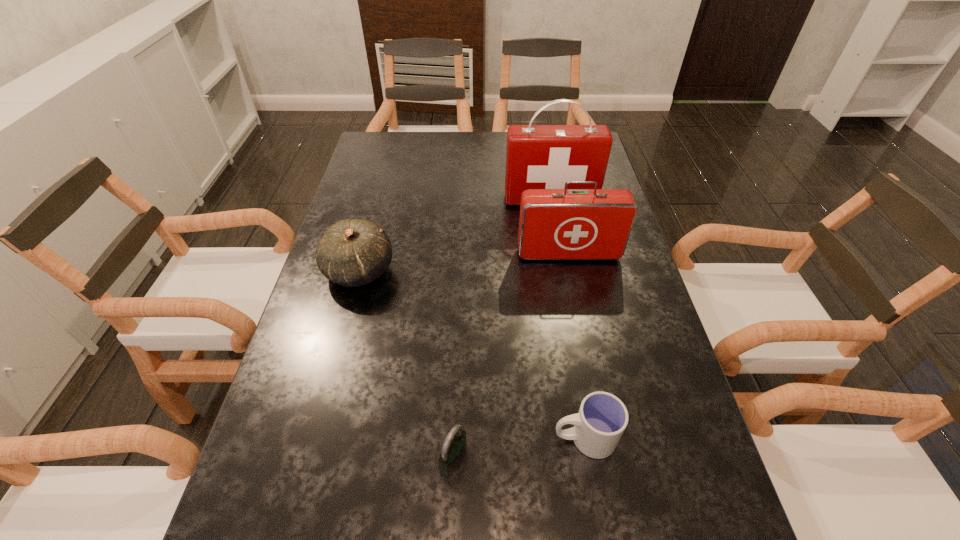
At what (x,y) coordinates should I click in order to perform the action: click on the farthest object. Please return your answer as a coordinate pair (x, y). Image resolution: width=960 pixels, height=540 pixels. Looking at the image, I should click on (538, 156).

In order to click on the taller first-aid kit in this screenshot , I will do `click(538, 156)`.

Where is `the fourth shortest object`? Image resolution: width=960 pixels, height=540 pixels. the fourth shortest object is located at coordinates (555, 224).

Image resolution: width=960 pixels, height=540 pixels. I want to click on the nearer first-aid kit, so click(555, 224).

You are a GUI agent. You are given a task and a screenshot of the screen. Output one action in this format:
    pyautogui.click(x=<x>, y=<y>)
    Task: Click on the gourd
    This screenshot has width=960, height=540.
    Given the screenshot: What is the action you would take?
    pyautogui.click(x=353, y=252)

You are a GUI agent. You are given a task and a screenshot of the screen. Output one action in this format:
    pyautogui.click(x=<x>, y=<y>)
    Task: Click on the third tallest object
    The image size is (960, 540).
    Given the screenshot: What is the action you would take?
    pyautogui.click(x=353, y=252)

Find the location of `padlock`. padlock is located at coordinates (453, 450).

Locate an element on the screen. The image size is (960, 540). cup is located at coordinates (602, 418).

Locate an element on the screen. vacant region located 0.050m on the front face of the farther first-aid kit is located at coordinates (554, 218).

Where is `vacant space positioned 0.230m on the side of the nearer first-aid kit with the first aid cross symbol`? vacant space positioned 0.230m on the side of the nearer first-aid kit with the first aid cross symbol is located at coordinates tap(585, 333).